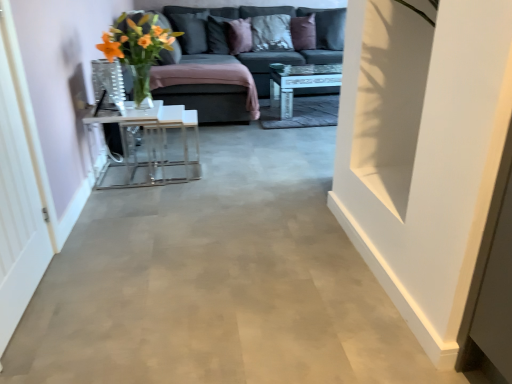
Question: In terms of height, does transparent glass door at left look taller or shorter compared to textured gray pillow at upper center, which is counted as the 4th pillow, starting from the left?

Choices:
 (A) short
 (B) tall

Answer: (B)

Question: Looking at the image, does transparent glass door at left seem bigger or smaller compared to textured gray pillow at upper center, the second pillow from the right?

Choices:
 (A) big
 (B) small

Answer: (B)

Question: Which object is positioned closest to the translucent glass vase at upper left?

Choices:
 (A) purple velvet pillow at upper center, marked as the first pillow in a right-to-left arrangement
 (B) dark gray fabric pillow at upper center, positioned as the 2th pillow in left-to-right order
 (C) white glossy coffee table at center, which is the 1th table from right to left
 (D) purple velvet pillow at upper center, the third pillow positioned from the left
 (E) clear glass table at center, marked as the 2th table in a top-to-bottom arrangement

Answer: (E)

Question: Which object is positioned closest to the dark gray fabric couch at upper center?

Choices:
 (A) transparent glass door at left
 (B) purple velvet pillow at upper center, the 3th pillow when ordered from right to left
 (C) white glossy coffee table at center, which ranks as the 2th table in bottom-to-top order
 (D) white matte door at right
 (E) translucent glass vase at upper left

Answer: (C)